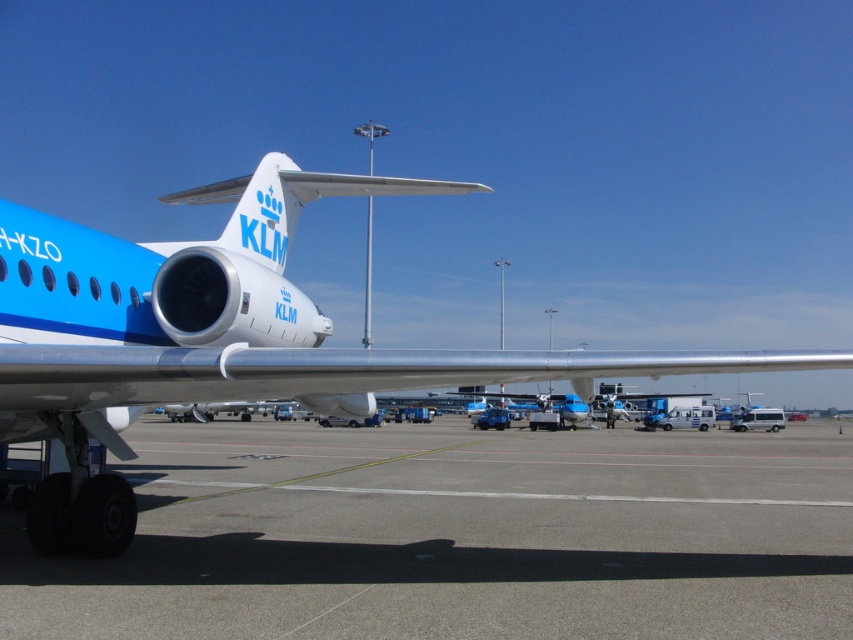
Question: Which of the following is the closest to the observer?

Choices:
 (A) matte blue airplane at center
 (B) gray concrete runway at center

Answer: (B)

Question: Observing the image, what is the correct spatial positioning of gray concrete runway at center in reference to matte blue airplane at center?

Choices:
 (A) left
 (B) right

Answer: (B)

Question: Is gray concrete runway at center smaller than matte blue airplane at center?

Choices:
 (A) no
 (B) yes

Answer: (A)

Question: Is gray concrete runway at center to the right of matte blue airplane at center from the viewer's perspective?

Choices:
 (A) no
 (B) yes

Answer: (B)

Question: Which point appears farthest from the camera in this image?

Choices:
 (A) (776, 632)
 (B) (288, 314)

Answer: (B)